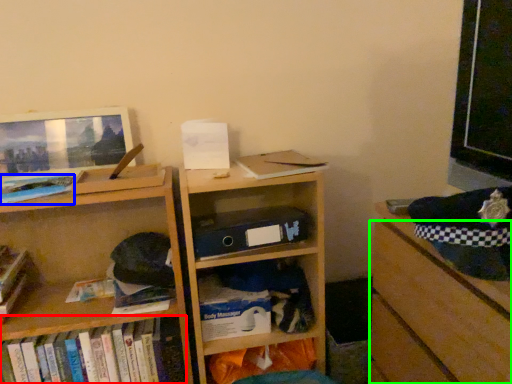
Question: Based on their relative distances, which object is nearer to book (highlighted by a red box)? Choose from book (highlighted by a blue box) and drawer (highlighted by a green box).

Choices:
 (A) book
 (B) drawer

Answer: (A)